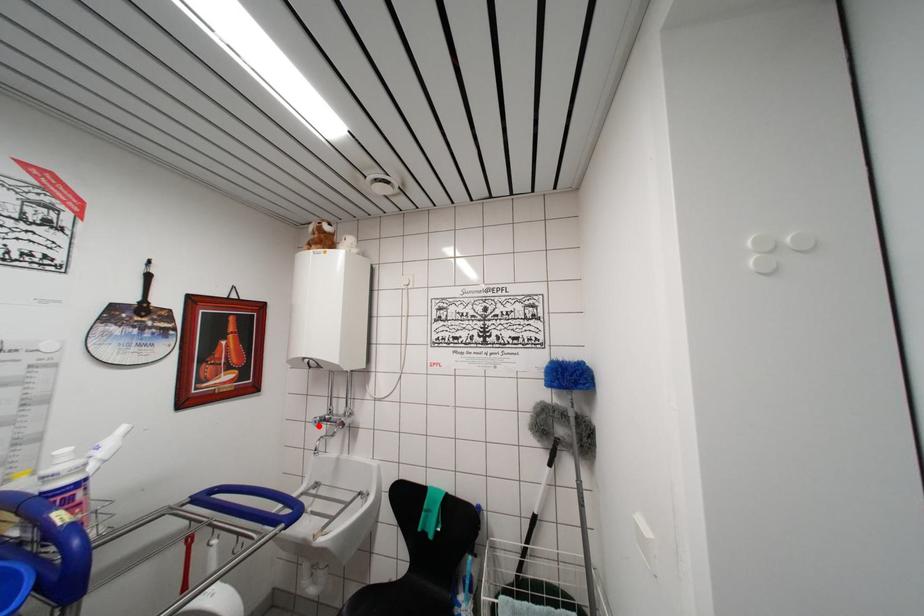
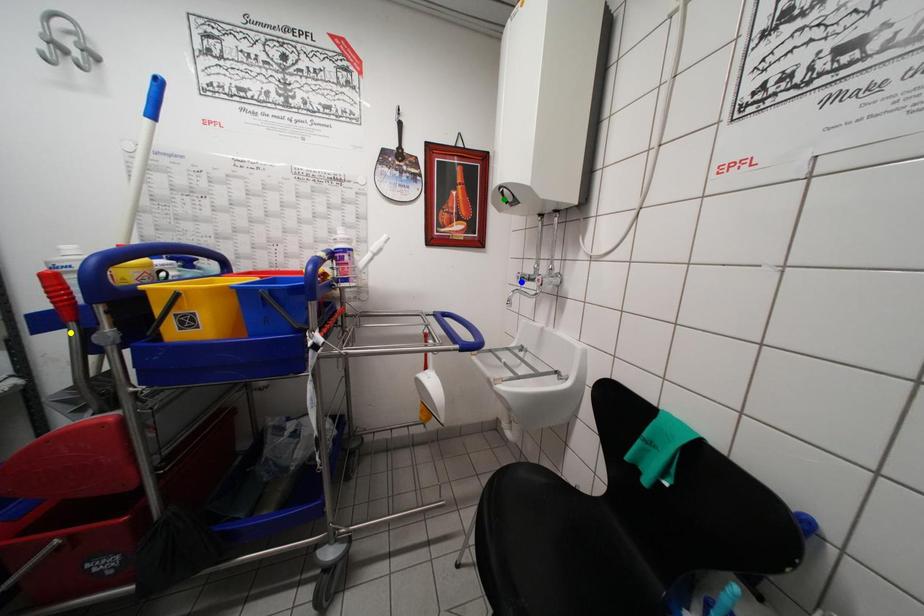
Question: I am providing you with two images of the same scene from different viewpoints. A red point is marked on the first image. You are given multiple points on the second image. Which point in image 2 is actually the same real-world point as the red point in image 1?

Choices:
 (A) blue point
 (B) yellow point
 (C) green point

Answer: (A)